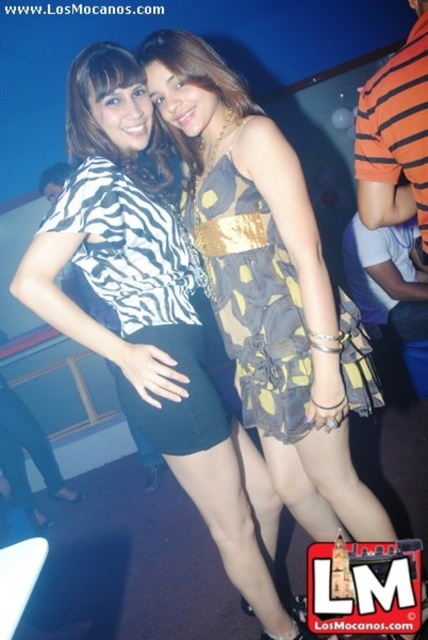
Question: Which is farther from the yellow dotted dress at center?

Choices:
 (A) zebra print blouse at center
 (B) printed fabric dress at center

Answer: (A)

Question: Can you confirm if zebra print blouse at center is bigger than zebra print fabric dress at center?

Choices:
 (A) yes
 (B) no

Answer: (A)

Question: Which point is farther to the camera?

Choices:
 (A) zebra print blouse at center
 (B) printed fabric dress at center
 (C) yellow dotted dress at center
 (D) zebra print fabric dress at center

Answer: (B)

Question: Does zebra print blouse at center lie behind printed fabric dress at center?

Choices:
 (A) no
 (B) yes

Answer: (A)

Question: Can you confirm if yellow dotted dress at center is positioned to the right of printed fabric dress at center?

Choices:
 (A) yes
 (B) no

Answer: (A)

Question: Which of the following is the closest to the observer?

Choices:
 (A) (109, 276)
 (B) (214, 262)
 (C) (365, 502)

Answer: (A)